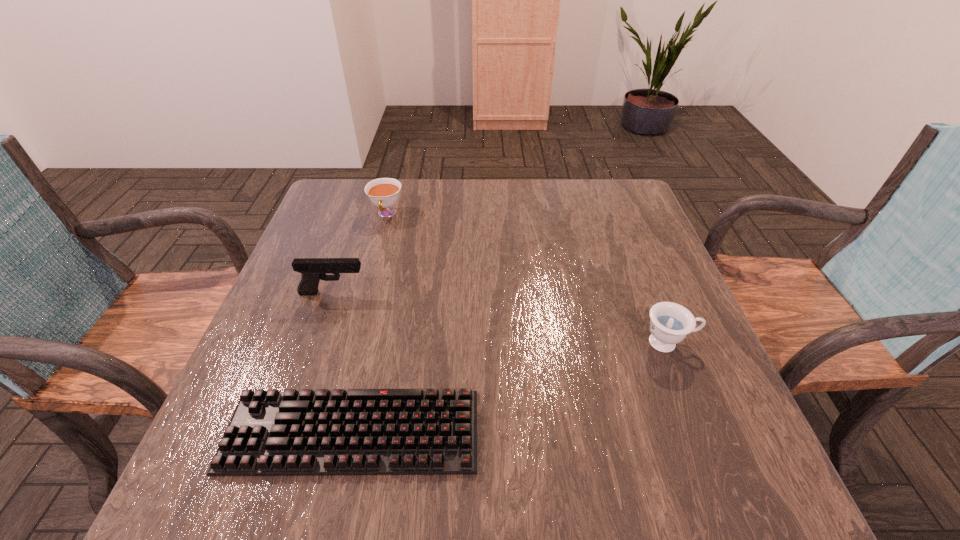
Locate an element on the screen. vacant space that satisfies the following two spatial constraints: 1. on the side of the left teacup with the handle; 2. on the right side of the nearest object is located at coordinates (329, 432).

What are the coordinates of `blank space that satisfies the following two spatial constraints: 1. on the side of the farthest object with the handle; 2. on the front-facing side of the tallest object` in the screenshot? It's located at (366, 293).

Locate an element on the screen. vacant region that satisfies the following two spatial constraints: 1. on the front-facing side of the third nearest object; 2. on the back side of the nearest object is located at coordinates (285, 432).